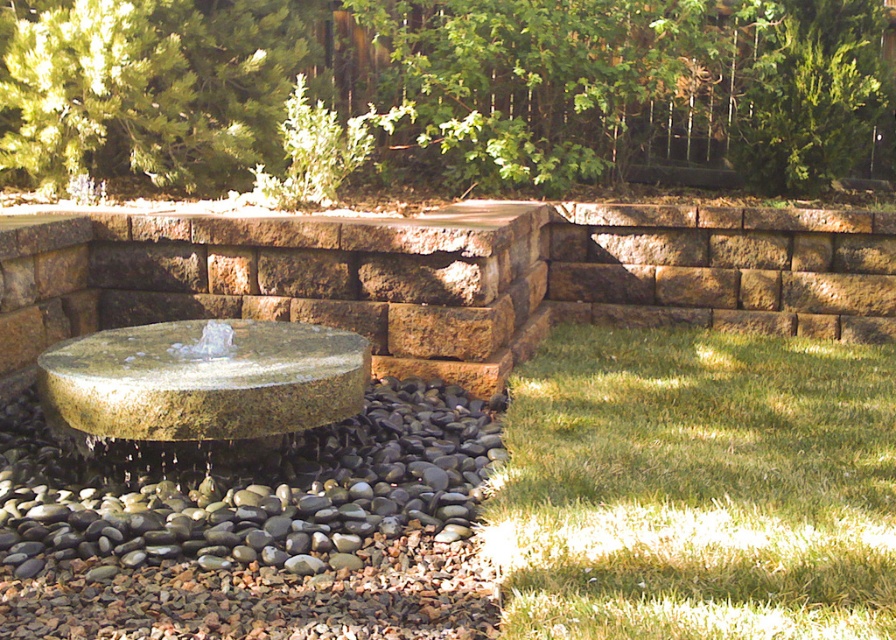
You are standing in the garden and want to walk from the green grass at lower right to the green stone wall at center. Which direction should you move to reach the wall?

Since the green grass at lower right is behind the green stone wall at center, you should move forward towards the green stone wall at center to reach it.